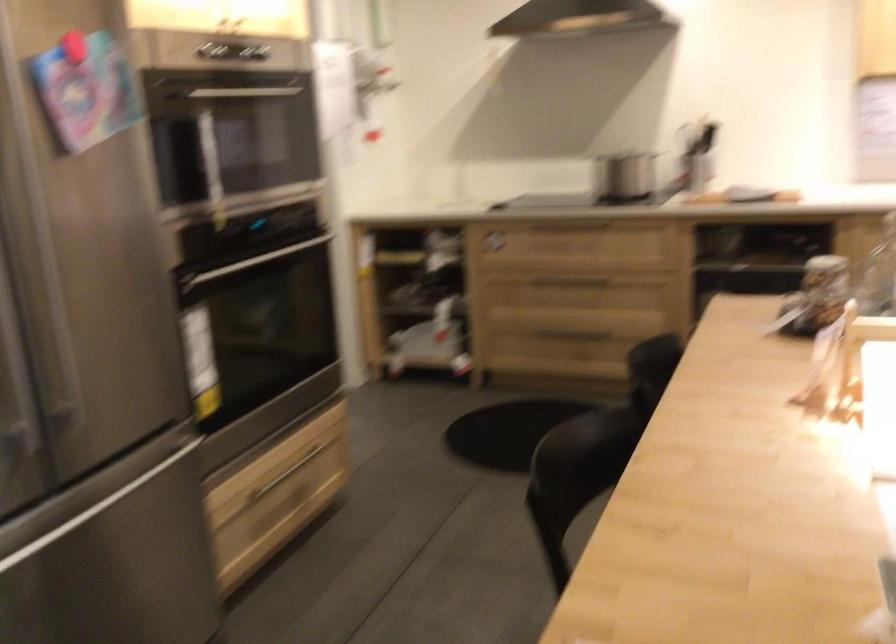
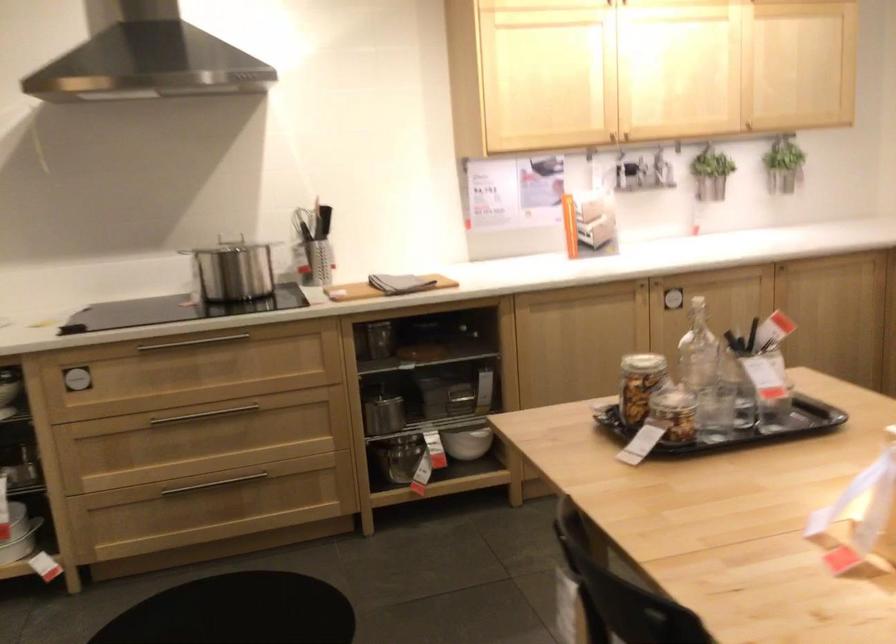
The point at (634, 137) is marked in the first image. Where is the corresponding point in the second image?

(229, 236)